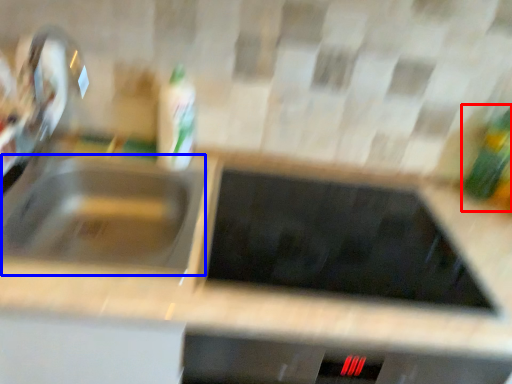
Question: Which object appears farthest to the camera in this image, bottle (highlighted by a red box) or sink (highlighted by a blue box)?

Choices:
 (A) bottle
 (B) sink

Answer: (A)